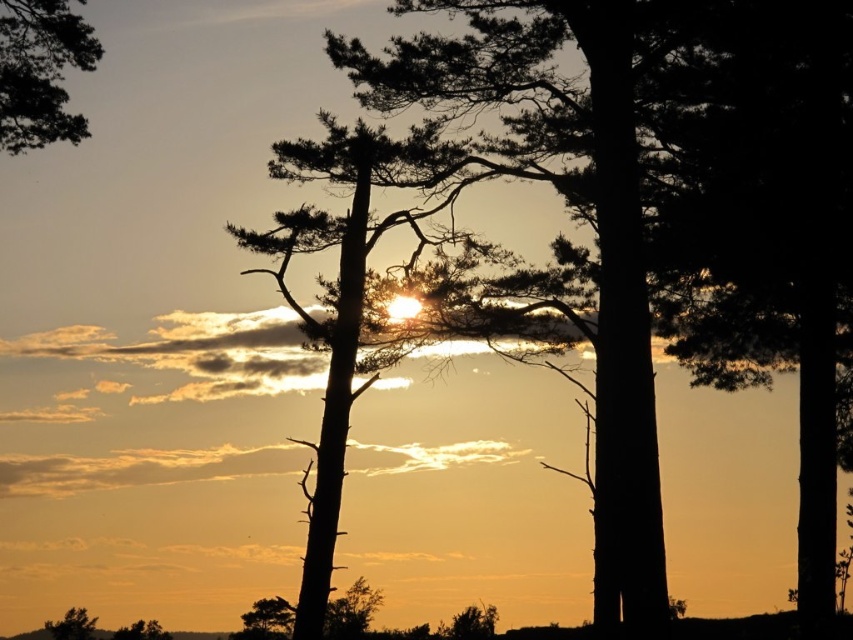
Question: Which of the following is the closest to the observer?

Choices:
 (A) pyautogui.click(x=38, y=54)
 (B) pyautogui.click(x=128, y=636)

Answer: (A)

Question: Is silhouette pine tree at upper left closer to camera compared to silvery bark tree at lower left?

Choices:
 (A) no
 (B) yes

Answer: (B)

Question: Is silhouette pine tree at upper left positioned at the back of silvery bark tree at lower left?

Choices:
 (A) no
 (B) yes

Answer: (A)

Question: Which object is farther from the camera taking this photo?

Choices:
 (A) green matte tree at lower left
 (B) silvery bark tree at lower left

Answer: (B)

Question: Is silvery bark tree at lower left closer to camera compared to green matte tree at lower left?

Choices:
 (A) yes
 (B) no

Answer: (B)

Question: Which point appears farthest from the camera in this image?

Choices:
 (A) (68, 33)
 (B) (82, 632)

Answer: (B)